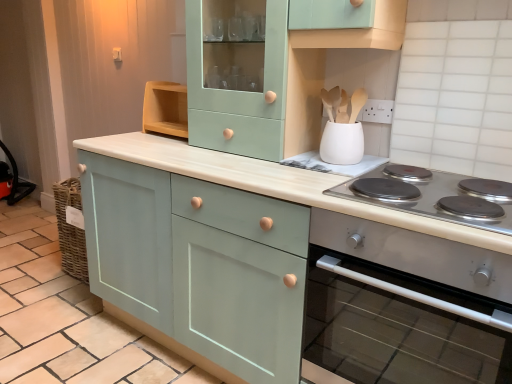
Question: Choose the correct answer: Is matte teal cabinet at center, arranged as the 3th cabinetry when viewed from the right, inside matte green cabinet at center, which is the 3th cabinetry from left to right, or outside it?

Choices:
 (A) inside
 (B) outside

Answer: (B)

Question: Looking at the image, does matte teal cabinet at center, placed as the 1th cabinetry when sorted from left to right, seem bigger or smaller compared to matte green cabinet at center, acting as the 1th cabinetry starting from the right?

Choices:
 (A) small
 (B) big

Answer: (A)

Question: Estimate the real-world distances between objects in this image. Which object is closer to the matte green cabinet at center, acting as the 1th cabinetry starting from the right?

Choices:
 (A) mint green wood cabinet at upper center, which appears as the second cabinetry when viewed from the right
 (B) matte teal cabinet at center, arranged as the 3th cabinetry when viewed from the right
 (C) satin silver oven at right
 (D) white matte utensil holder at upper center
 (E) silver metallic cooktop at lower right

Answer: (B)

Question: Estimate the real-world distances between objects in this image. Which object is closer to the mint green wood cabinet at upper center, which appears as the second cabinetry when viewed from the right?

Choices:
 (A) white matte utensil holder at upper center
 (B) matte teal cabinet at center, placed as the 1th cabinetry when sorted from left to right
 (C) silver metallic cooktop at lower right
 (D) satin silver oven at right
 (E) matte green cabinet at center, acting as the 1th cabinetry starting from the right

Answer: (E)